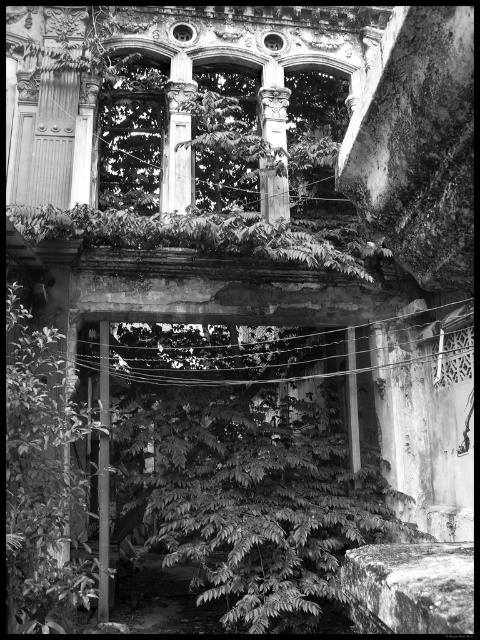
Is green leafy tree at center in front of smooth white column at center?

Yes.

I want to click on green leafy tree at center, so click(41, 481).

Does point (58, 403) come closer to viewer compared to point (167, 170)?

That is True.

The image size is (480, 640). Identify the location of green leafy tree at center. (41, 481).

From the picture: Is smooth white column at center closer to the viewer compared to smooth stone column at center?

Yes.

Who is taller, smooth white column at center or smooth stone column at center?

Standing taller between the two is smooth white column at center.

Is point (194, 88) closer to viewer compared to point (282, 131)?

Yes.

You are a GUI agent. You are given a task and a screenshot of the screen. Output one action in this format:
    pyautogui.click(x=<x>, y=<y>)
    Task: Click on the smooth white column at center
    The height and width of the screenshot is (640, 480).
    Given the screenshot: What is the action you would take?
    pyautogui.click(x=177, y=138)

Which is more to the right, green leafy tree at center or smooth stone column at center?

Positioned to the right is smooth stone column at center.

Between point (7, 376) and point (276, 122), which one is positioned in front?

Point (7, 376) is more forward.

This screenshot has width=480, height=640. Find the location of `green leafy tree at center`. green leafy tree at center is located at coordinates (41, 481).